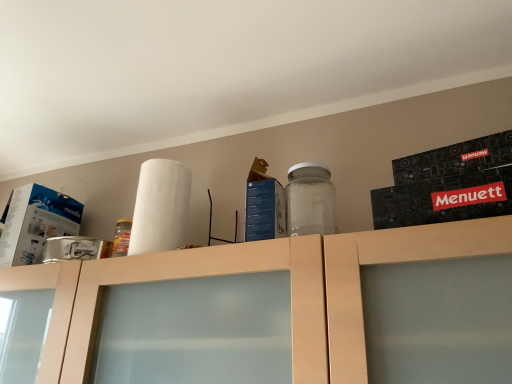
Question: Considering the relative positions of blue cardboard box at center, the first box from the right, and matte wood cabinet at upper center in the image provided, is blue cardboard box at center, the first box from the right, to the left of matte wood cabinet at upper center from the viewer's perspective?

Choices:
 (A) yes
 (B) no

Answer: (B)

Question: Does blue cardboard box at center, the first box when ordered from front to back, lie in front of matte wood cabinet at upper center?

Choices:
 (A) no
 (B) yes

Answer: (A)

Question: Does blue cardboard box at center, the first box when ordered from front to back, have a larger size compared to matte wood cabinet at upper center?

Choices:
 (A) yes
 (B) no

Answer: (B)

Question: Is blue cardboard box at center, which is counted as the 2th box, starting from the left, aimed at matte wood cabinet at upper center?

Choices:
 (A) yes
 (B) no

Answer: (B)

Question: Considering the relative positions of blue cardboard box at center, which appears as the 2th box when viewed from the back, and matte wood cabinet at upper center in the image provided, is blue cardboard box at center, which appears as the 2th box when viewed from the back, to the right of matte wood cabinet at upper center from the viewer's perspective?

Choices:
 (A) no
 (B) yes

Answer: (B)

Question: Is point (390, 248) positioned closer to the camera than point (159, 195)?

Choices:
 (A) closer
 (B) farther

Answer: (A)

Question: From a real-world perspective, is matte wood cabinet at upper center above or below white matte paper towel at upper center?

Choices:
 (A) above
 (B) below

Answer: (B)

Question: Would you say matte wood cabinet at upper center is to the left or to the right of white matte paper towel at upper center in the picture?

Choices:
 (A) right
 (B) left

Answer: (A)

Question: From their relative heights in the image, would you say matte wood cabinet at upper center is taller or shorter than white matte paper towel at upper center?

Choices:
 (A) short
 (B) tall

Answer: (B)

Question: Do you think matte wood cabinet at upper center is within white cardboard box at left, the first box in the left-to-right sequence, or outside of it?

Choices:
 (A) outside
 (B) inside

Answer: (A)

Question: In the image, is matte wood cabinet at upper center positioned in front of or behind white cardboard box at left, which appears as the 2th box when viewed from the front?

Choices:
 (A) front
 (B) behind

Answer: (A)

Question: Visually, is matte wood cabinet at upper center positioned to the left or to the right of white cardboard box at left, which appears as the 2th box when viewed from the front?

Choices:
 (A) right
 (B) left

Answer: (A)

Question: Looking at their shapes, would you say matte wood cabinet at upper center is wider or thinner than white cardboard box at left, positioned as the second box in right-to-left order?

Choices:
 (A) wide
 (B) thin

Answer: (A)

Question: In the image, is white matte paper towel at upper center positioned in front of or behind matte wood cabinet at upper center?

Choices:
 (A) behind
 (B) front

Answer: (A)

Question: Based on their positions, is white matte paper towel at upper center located to the left or right of matte wood cabinet at upper center?

Choices:
 (A) right
 (B) left

Answer: (B)